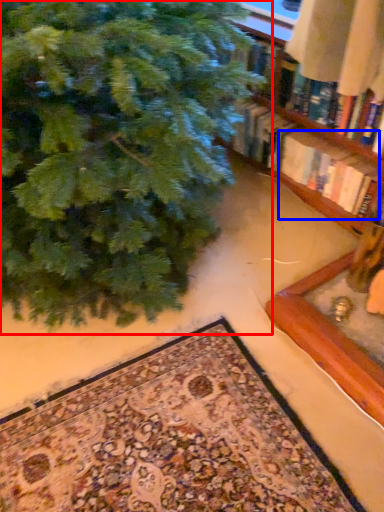
Question: Which object is closer to the camera taking this photo, christmas tree (highlighted by a red box) or book (highlighted by a blue box)?

Choices:
 (A) christmas tree
 (B) book

Answer: (A)